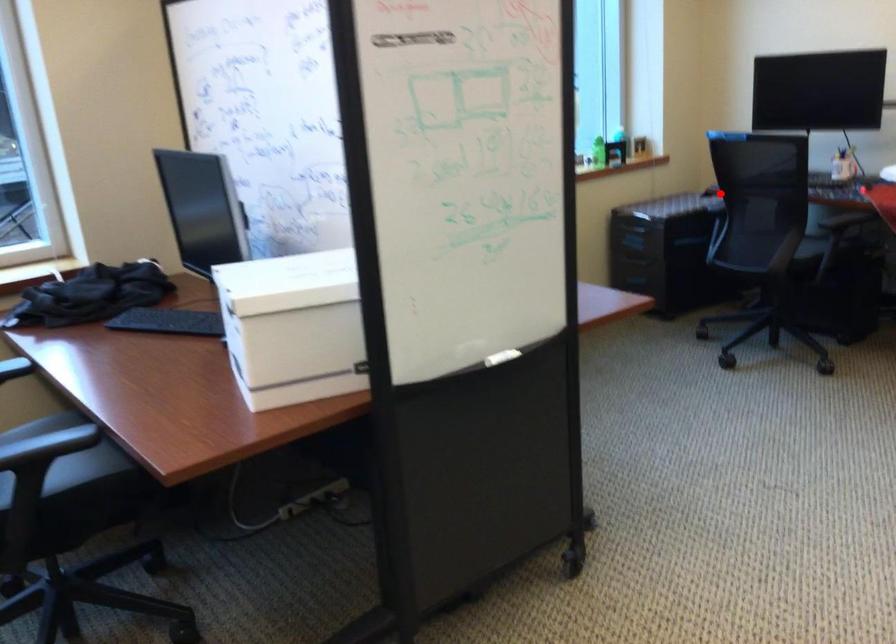
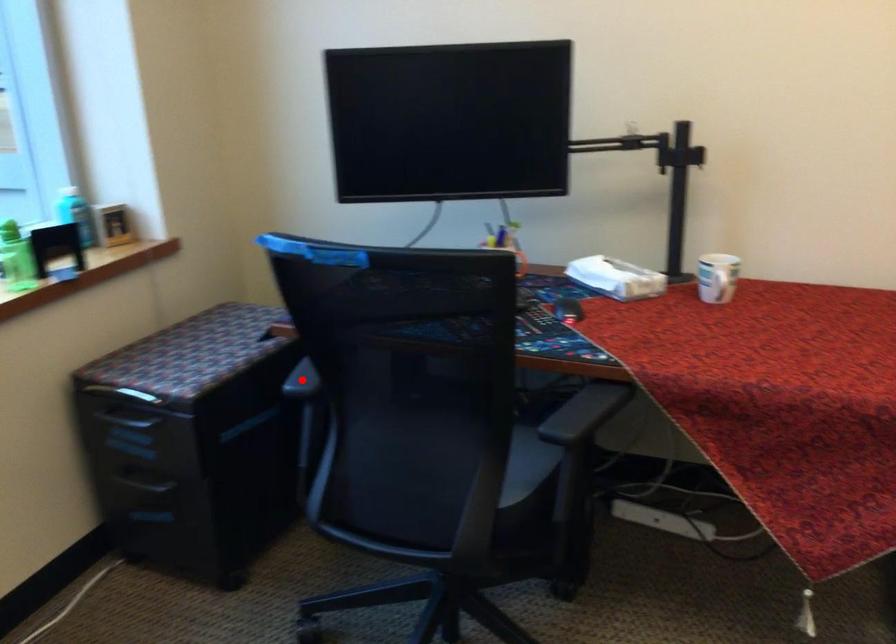
I am providing you with two images of the same scene from different viewpoints. A red point is marked on the first image and another point is marked on the second image. Do the highlighted points in image1 and image2 indicate the same real-world spot?

Yes